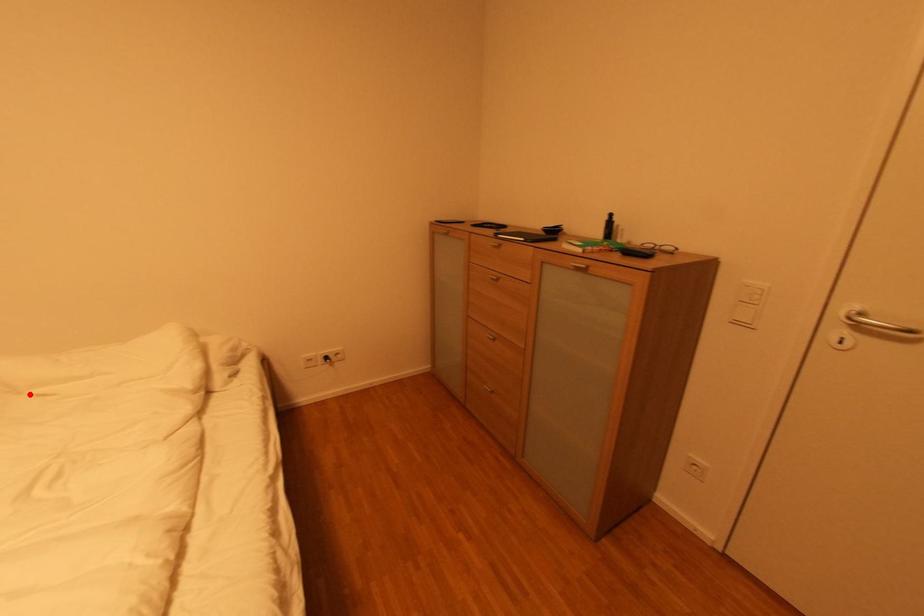
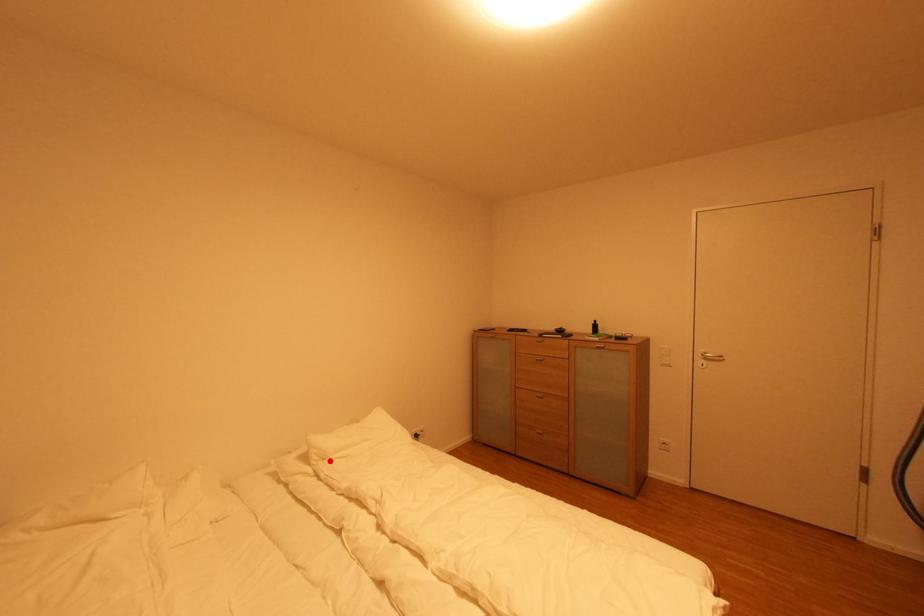
I am providing you with two images of the same scene from different viewpoints. A red point is marked on the first image and another point is marked on the second image. Do the highlighted points in image1 and image2 indicate the same real-world spot?

Yes